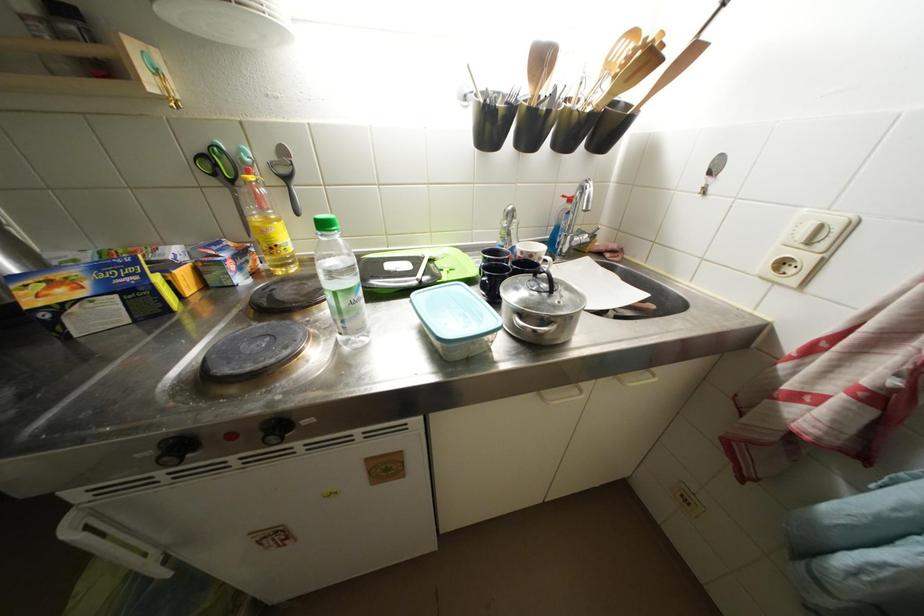
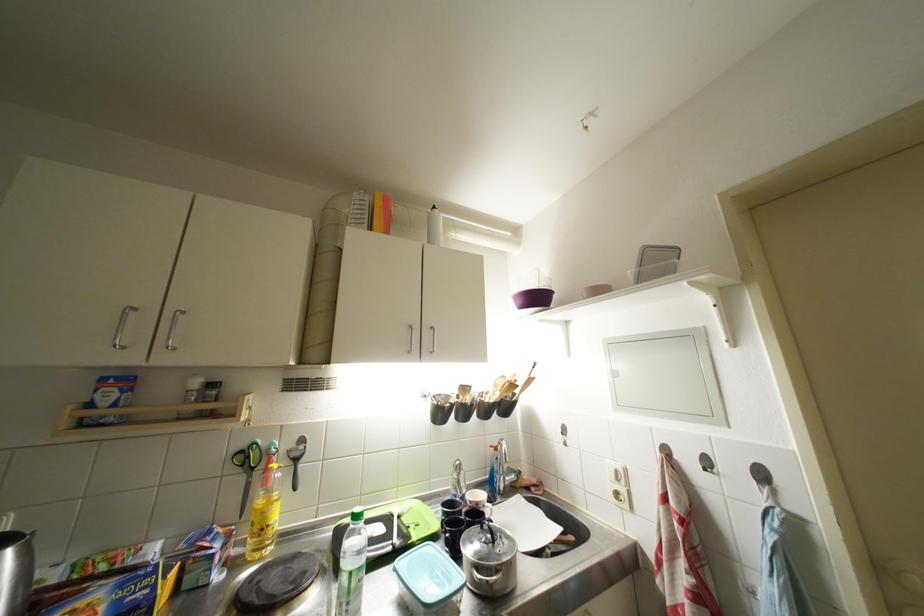
Locate, in the second image, the point that corresponds to pixel 270 235 in the first image.

(271, 517)